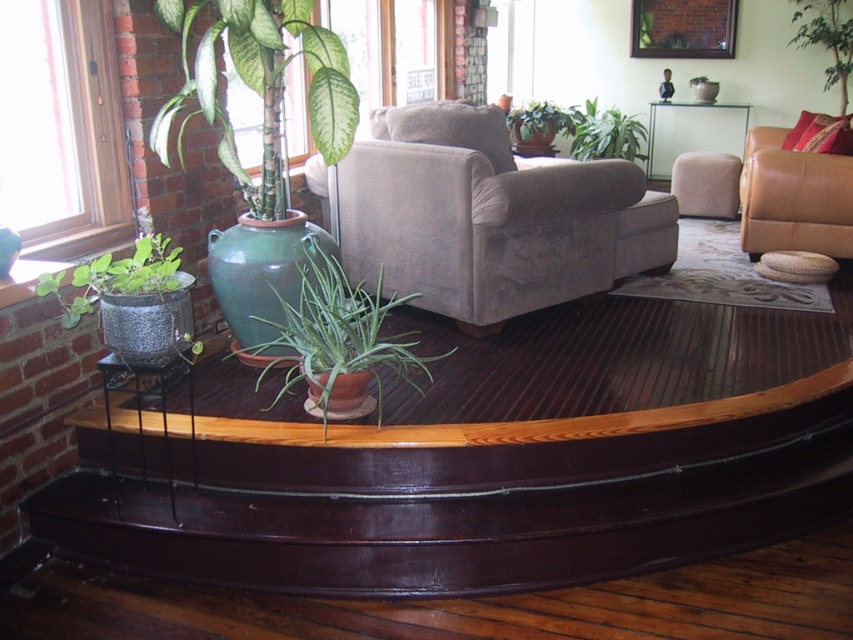
Consider the image. You are sitting in the velvet beige armchair at center and want to place a book on the white glossy table at upper center. Can you reach it without getting up?

The velvet beige armchair at center is closer to the viewer than the white glossy table at upper center, so you would need to get up to reach the table.

You are a drone operator trying to map the location of the green glossy plant at upper right in the living room. The room is divided into a grid with coordinates ranging from 0 to 1 on both axes. Where would you mark its position?

The green glossy plant at upper right is located at the 2D coordinates of point 0.062 on the x axis and 0.970 on the y axis.

You are arranging flowers in a living room and need to place a new decorative item between the green glossy vase at upper left and the green clay pot at center. Based on their positions, where should you place the item to ensure it is centered between them?

The green glossy vase at upper left is to the left of green clay pot at center, so placing the new item directly between them along the horizontal axis would center it between the two objects.